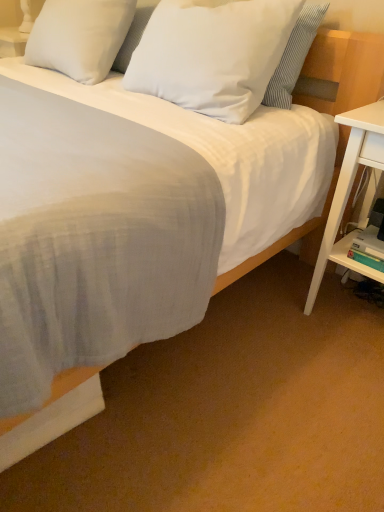
Question: Is white matte pillow at upper center, acting as the 2th pillow starting from the left, oriented away from white wood nightstand at right?

Choices:
 (A) yes
 (B) no

Answer: (B)

Question: Considering the relative sizes of white matte pillow at upper center, which appears as the 1th pillow when viewed from the right, and white wood nightstand at right in the image provided, is white matte pillow at upper center, which appears as the 1th pillow when viewed from the right, taller than white wood nightstand at right?

Choices:
 (A) no
 (B) yes

Answer: (A)

Question: From a real-world perspective, is white matte pillow at upper center, acting as the 2th pillow starting from the left, beneath white wood nightstand at right?

Choices:
 (A) yes
 (B) no

Answer: (B)

Question: Is white matte pillow at upper center, acting as the 2th pillow starting from the left, at the right side of white wood nightstand at right?

Choices:
 (A) no
 (B) yes

Answer: (A)

Question: Is white matte pillow at upper center, acting as the 2th pillow starting from the left, positioned far away from white wood nightstand at right?

Choices:
 (A) no
 (B) yes

Answer: (A)

Question: Is white matte pillow at upper center, acting as the 2th pillow starting from the left, aimed at white wood nightstand at right?

Choices:
 (A) no
 (B) yes

Answer: (A)

Question: From the image's perspective, is white soft pillow at upper center, placed as the 1th pillow when sorted from left to right, located above white wood nightstand at right?

Choices:
 (A) no
 (B) yes

Answer: (B)

Question: From a real-world perspective, is white soft pillow at upper center, placed as the 1th pillow when sorted from left to right, physically above white wood nightstand at right?

Choices:
 (A) no
 (B) yes

Answer: (B)

Question: Does white soft pillow at upper center, which appears as the second pillow when viewed from the right, have a lesser width compared to white wood nightstand at right?

Choices:
 (A) no
 (B) yes

Answer: (B)

Question: Considering the relative sizes of white soft pillow at upper center, which appears as the second pillow when viewed from the right, and white wood nightstand at right in the image provided, is white soft pillow at upper center, which appears as the second pillow when viewed from the right, taller than white wood nightstand at right?

Choices:
 (A) no
 (B) yes

Answer: (A)

Question: Can you confirm if white soft pillow at upper center, placed as the 1th pillow when sorted from left to right, is positioned to the left of white wood nightstand at right?

Choices:
 (A) yes
 (B) no

Answer: (A)

Question: From the image's perspective, does white soft pillow at upper center, which appears as the second pillow when viewed from the right, appear lower than white wood nightstand at right?

Choices:
 (A) no
 (B) yes

Answer: (A)

Question: Can white plastic shelf at lower right be found inside white wood nightstand at right?

Choices:
 (A) yes
 (B) no

Answer: (A)